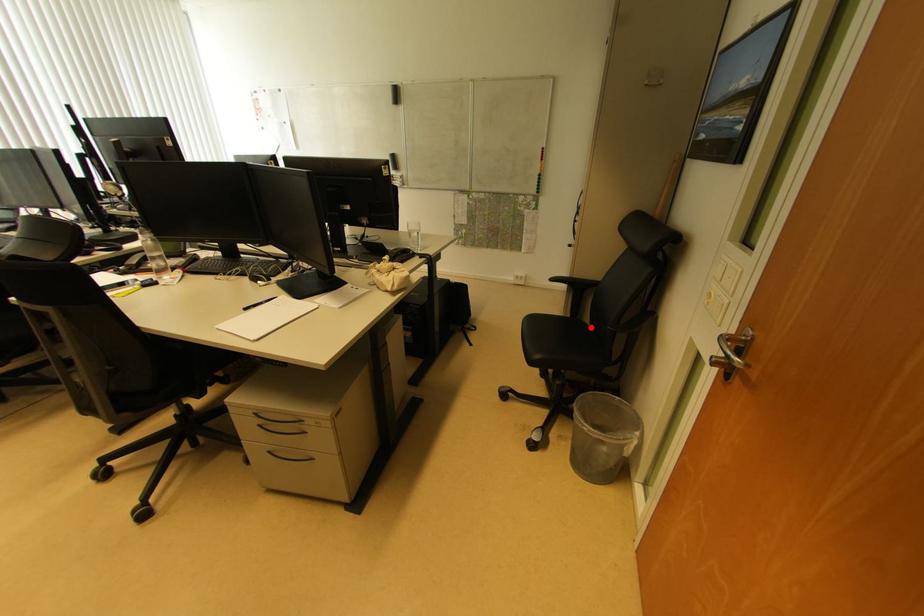
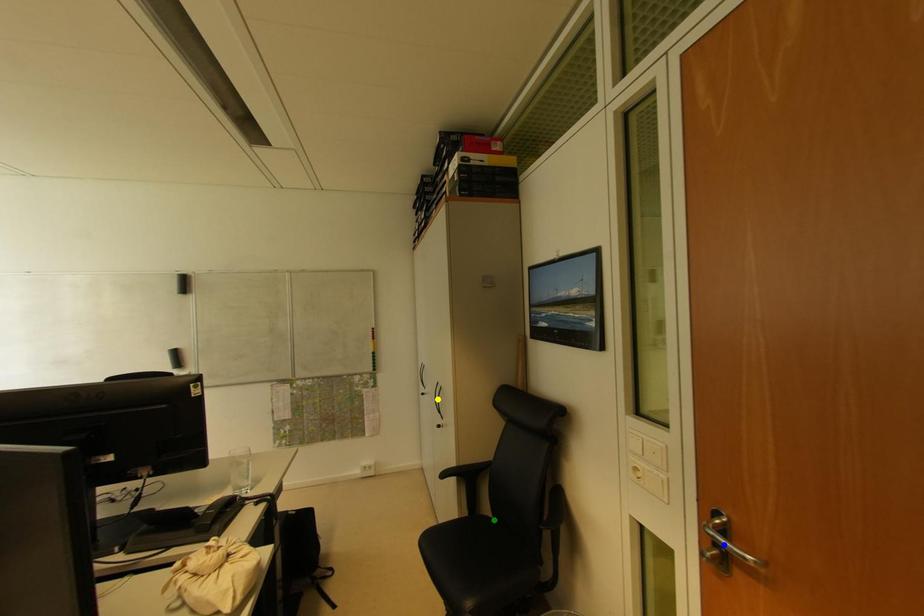
Question: I am providing you with two images of the same scene from different viewpoints. A red point is marked on the first image. You are given multiple points on the second image. Which point in image 2 is actually the same real-world point as the red point in image 1?

Choices:
 (A) yellow point
 (B) green point
 (C) blue point

Answer: (B)